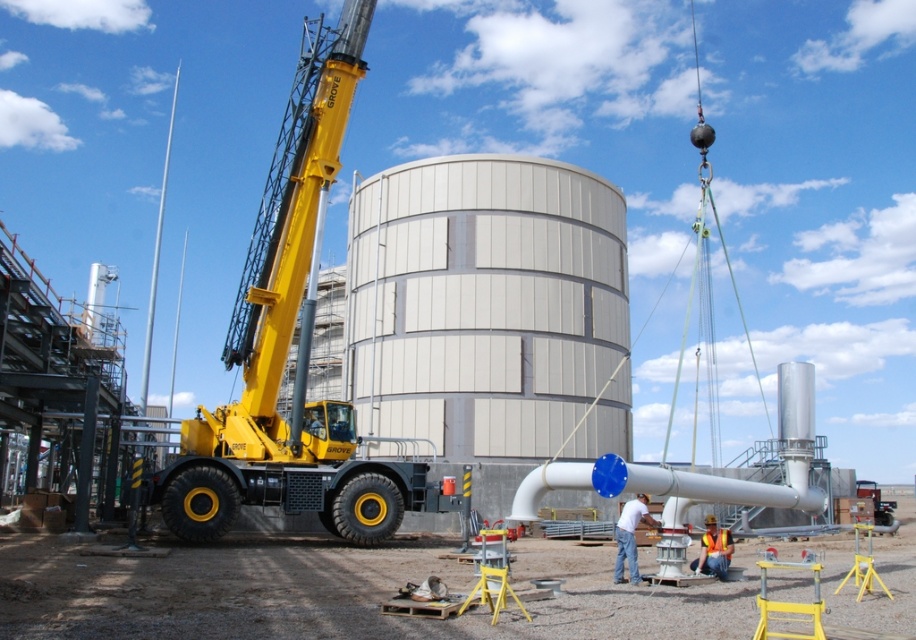
You are a safety inspector at the construction site. You need to ensure that the white glossy pipe at center is wide enough to accommodate a safety sticker that requires a minimum width of 15 cm. Can you confirm if the pipe meets this requirement based on the orange reflective vest at lower center?

The white glossy pipe at center is wider than the orange reflective vest at lower center. Since the safety sticker requires a minimum of 15 cm, and the pipe is wider than the vest, it likely meets the requirement. However, without knowing the exact width of the vest, we cannot be certain.

Consider the image. You are an inspector on the construction site. You need to determine if the white glossy pipe at center can be seen from above the orange reflective vest at lower center. Based on their heights, can you see the pipe from that position?

The white glossy pipe at center is much taller than the orange reflective vest at lower center, so yes, the pipe can be seen from above the vest.